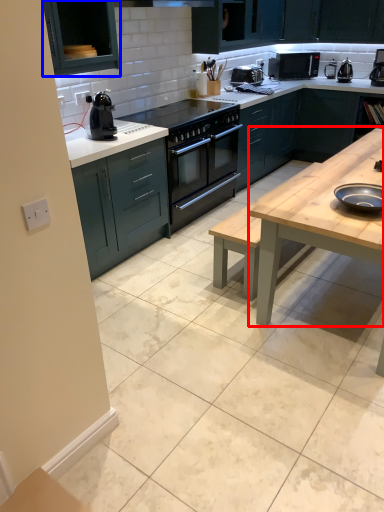
Question: Which object appears closest to the camera in this image, table (highlighted by a red box) or cabinetry (highlighted by a blue box)?

Choices:
 (A) table
 (B) cabinetry

Answer: (A)